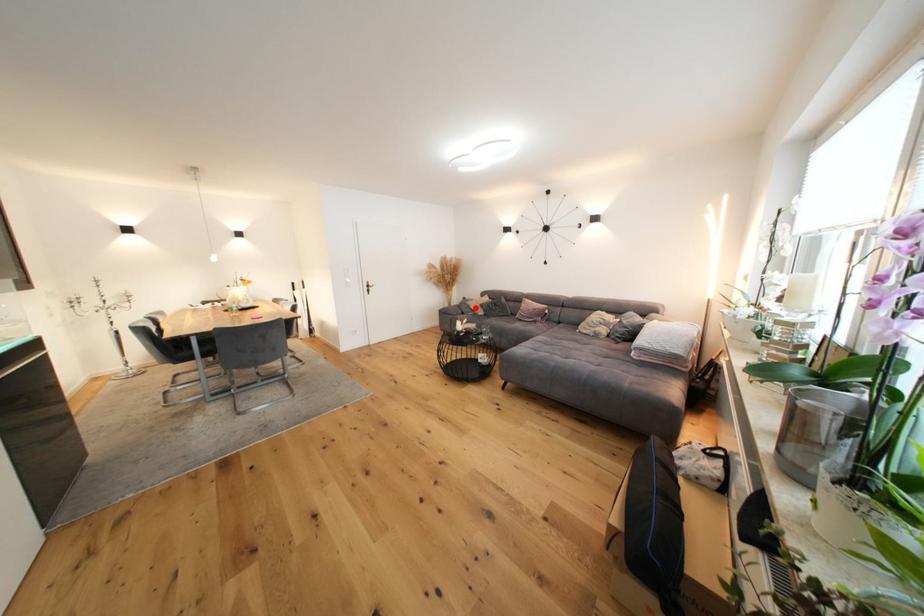
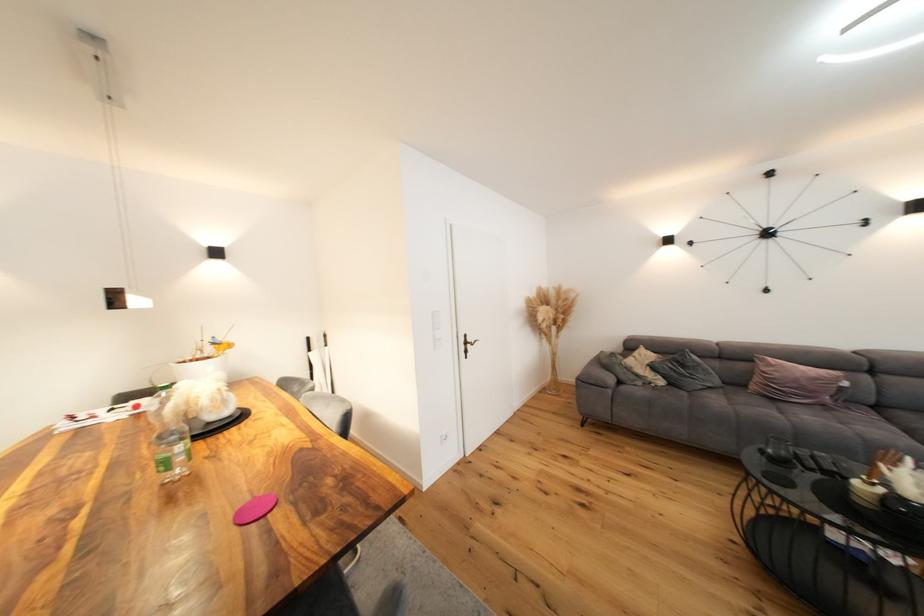
The point at the highlighted location is marked in the first image. Where is the corresponding point in the second image?

(637, 371)